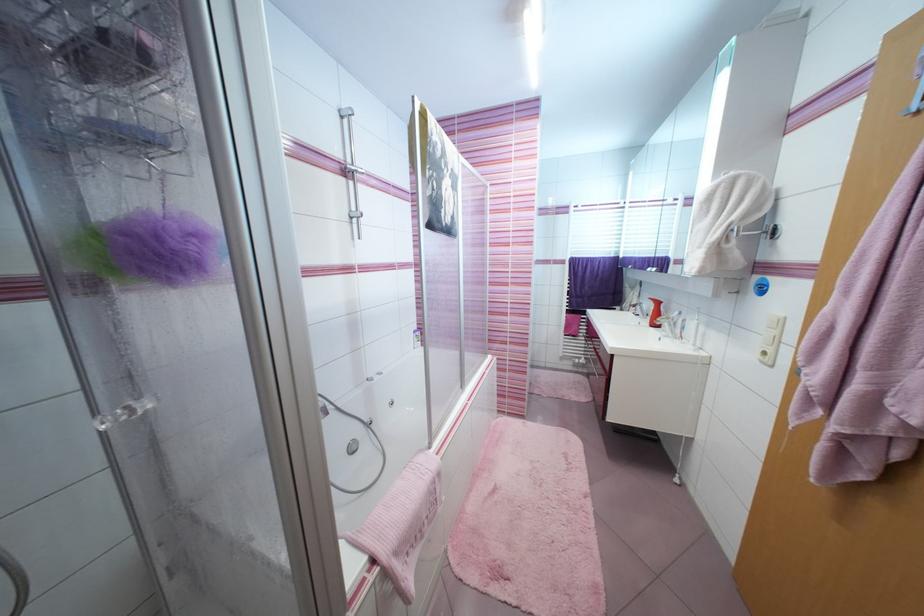
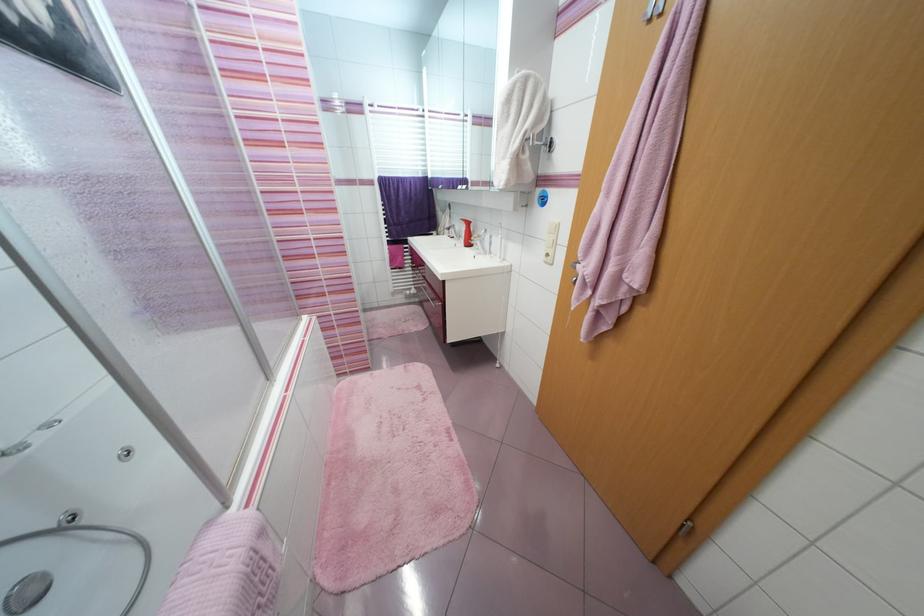
Where in the second image is the point corresponding to point 768,363 from the first image?

(551, 264)